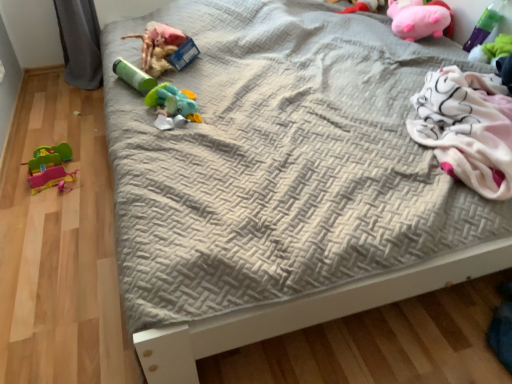
Where is `vacant space behind rubber duck at left, which is the seventh toy in right-to-left order`? vacant space behind rubber duck at left, which is the seventh toy in right-to-left order is located at coordinates (69, 139).